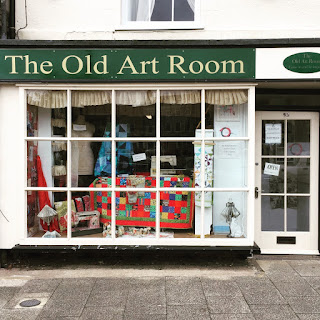
You are a GUI agent. You are given a task and a screenshot of the screen. Output one action in this format:
    pyautogui.click(x=<x>, y=<y>)
    Task: Click on the mannequin
    
    Given the screenshot: What is the action you would take?
    pyautogui.click(x=83, y=149)